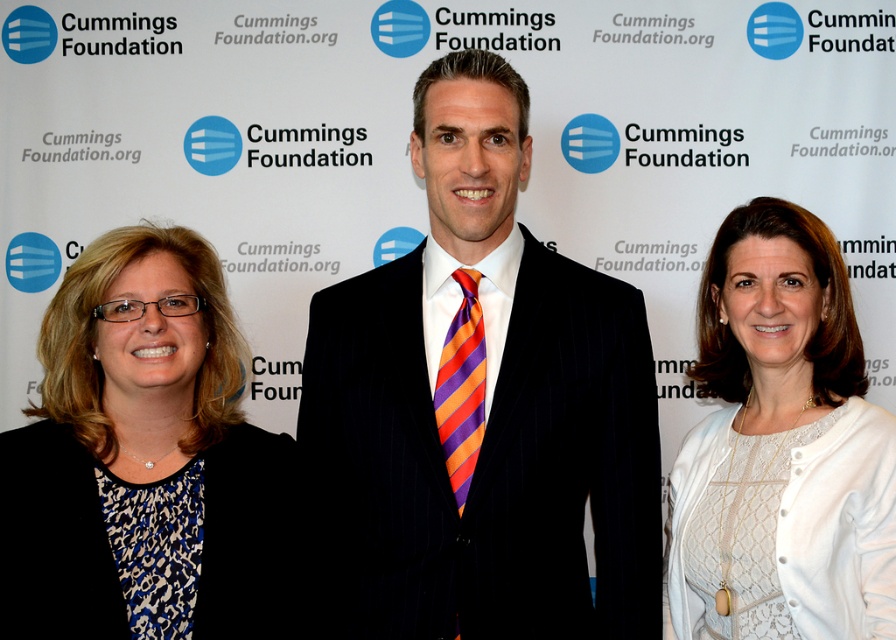
Question: Which point is farther from the camera taking this photo?

Choices:
 (A) (472, 316)
 (B) (438, 237)

Answer: (B)

Question: Can you confirm if white lace dress at center is positioned above orange and purple striped tie at center?

Choices:
 (A) yes
 (B) no

Answer: (B)

Question: Does white lace dress at center lie behind orange and purple striped tie at center?

Choices:
 (A) no
 (B) yes

Answer: (A)

Question: Which object is farther from the camera taking this photo?

Choices:
 (A) white lace dress at center
 (B) orange and purple striped tie at center
 (C) velvet black suit at center

Answer: (B)

Question: Which object is farther from the camera taking this photo?

Choices:
 (A) velvet black suit at center
 (B) blue printed blouse at left
 (C) orange and purple striped tie at center

Answer: (C)

Question: Does velvet black suit at center appear under white lace dress at center?

Choices:
 (A) no
 (B) yes

Answer: (A)